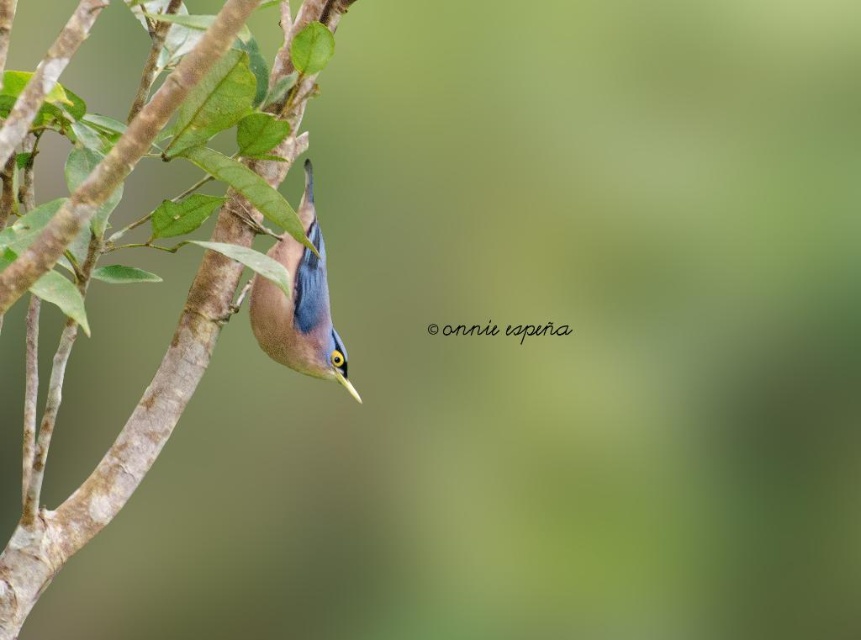
Question: Is smooth bark branch at center-left to the left of blue glossy bird at center-left from the viewer's perspective?

Choices:
 (A) no
 (B) yes

Answer: (B)

Question: Where is smooth bark branch at center-left located in relation to blue glossy bird at center-left in the image?

Choices:
 (A) left
 (B) right

Answer: (A)

Question: Is smooth bark branch at center-left below blue glossy bird at center-left?

Choices:
 (A) yes
 (B) no

Answer: (A)

Question: Which point is closer to the camera?

Choices:
 (A) smooth bark branch at center-left
 (B) blue glossy bird at center-left

Answer: (A)